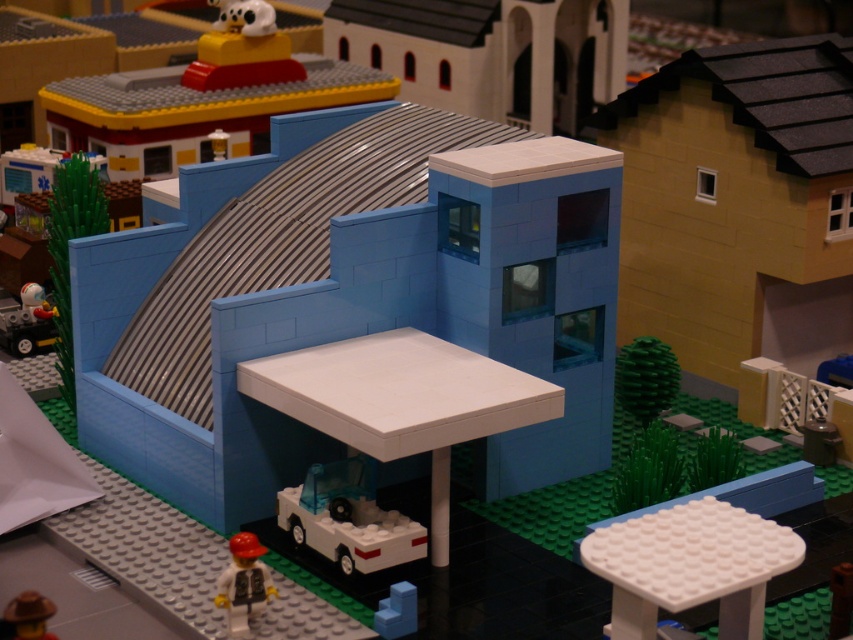
Question: Is white plastic stool at lower right wider than brown matte hat at lower left?

Choices:
 (A) no
 (B) yes

Answer: (B)

Question: Which point is closer to the camera?

Choices:
 (A) (280, 497)
 (B) (614, 611)
 (C) (45, 605)
 (D) (379, 620)

Answer: (B)

Question: Can you confirm if white plastic stool at lower right is positioned to the right of matte black car at lower left?

Choices:
 (A) yes
 (B) no

Answer: (A)

Question: Which point is closer to the camera?

Choices:
 (A) (258, 579)
 (B) (55, 636)
 (C) (401, 628)
 (D) (747, 513)

Answer: (D)

Question: Does white plastic stool at lower right have a smaller size compared to matte black car at lower left?

Choices:
 (A) yes
 (B) no

Answer: (B)

Question: Which object is closer to the camera taking this photo?

Choices:
 (A) white plastic stool at lower right
 (B) brown matte hat at lower left

Answer: (A)